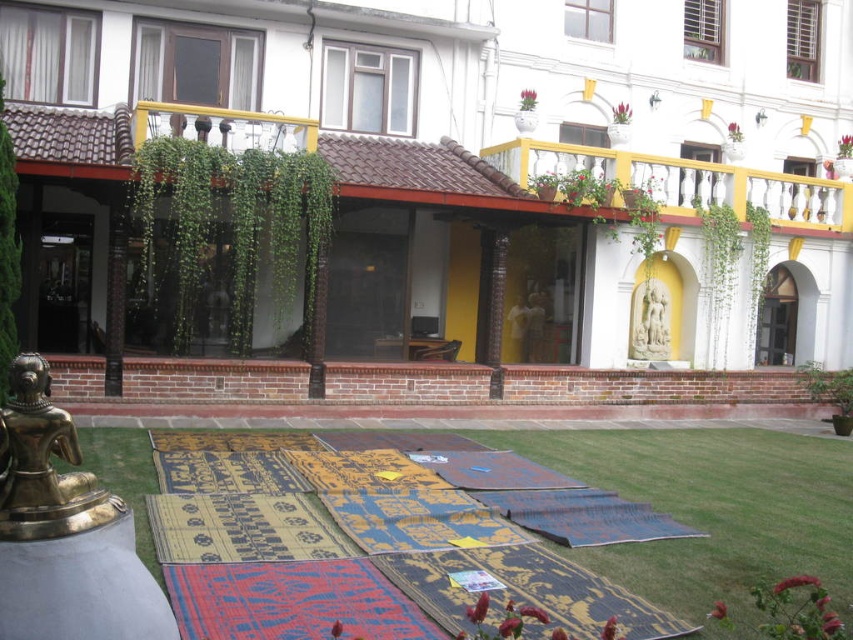
Which is behind, point (248, 515) or point (669, 348)?

Positioned behind is point (669, 348).

Can you confirm if textured woolen mat at lower center is positioned to the left of white stone statue at center?

Yes, textured woolen mat at lower center is to the left of white stone statue at center.

This screenshot has height=640, width=853. Find the location of `textured woolen mat at lower center`. textured woolen mat at lower center is located at coordinates (380, 534).

Between brass statue at lower left and white stone statue at center, which one is positioned higher?

white stone statue at center

Which is behind, point (30, 484) or point (668, 308)?

The point (668, 308) is behind.

Is point (39, 477) positioned after point (668, 355)?

No.

In order to click on brass statue at lower left in this screenshot , I will do `click(44, 465)`.

Does textured woolen mat at lower center have a greater width compared to brass statue at lower left?

Yes.

Is point (641, 605) more distant than point (16, 452)?

That is True.

The height and width of the screenshot is (640, 853). I want to click on textured woolen mat at lower center, so click(380, 534).